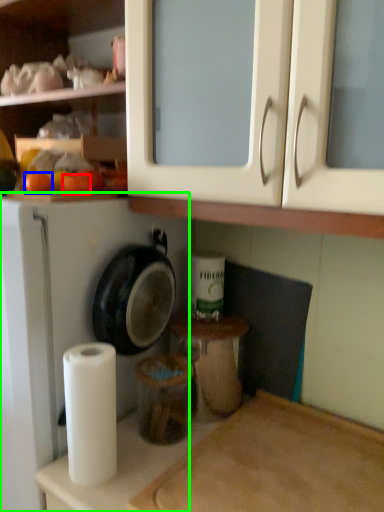
Question: Based on their relative distances, which object is farther from orange (highlighted by a red box)? Choose from orange (highlighted by a blue box) and dish washer (highlighted by a green box).

Choices:
 (A) orange
 (B) dish washer

Answer: (B)